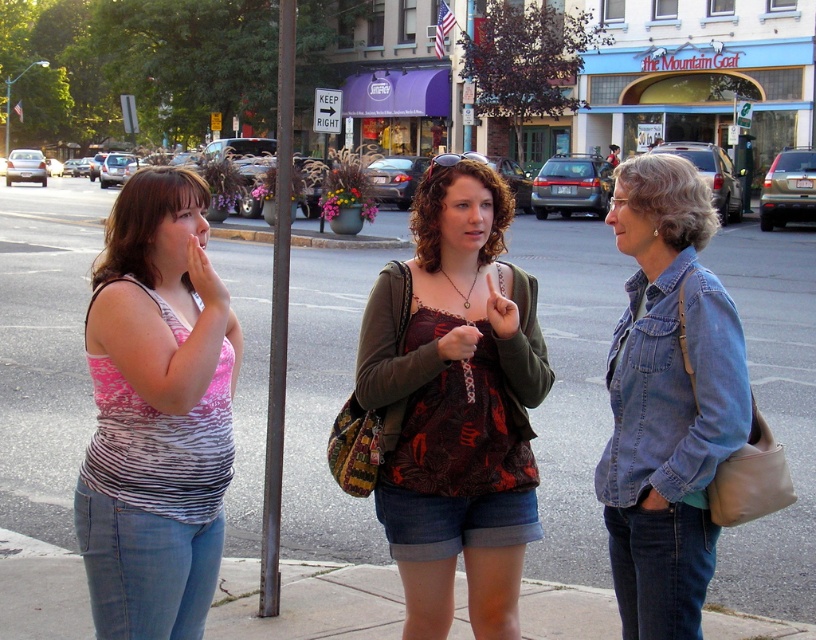
Question: Does pink striped tank top at left lie in front of denim jacket at lower right?

Choices:
 (A) yes
 (B) no

Answer: (A)

Question: Based on their relative distances, which object is nearer to the paved concrete sidewalk at center?

Choices:
 (A) dark gray metal pole at center
 (B) matte brown purse at center
 (C) pink striped tank top at left

Answer: (A)

Question: Is paved concrete sidewalk at center bigger than matte brown purse at center?

Choices:
 (A) yes
 (B) no

Answer: (A)

Question: Does matte brown purse at center appear over denim jacket at lower right?

Choices:
 (A) no
 (B) yes

Answer: (A)

Question: Which point is farther to the camera?

Choices:
 (A) dark gray metal pole at center
 (B) paved concrete sidewalk at center
 (C) pink striped tank top at left

Answer: (B)

Question: Considering the real-world distances, which object is farthest from the matte brown purse at center?

Choices:
 (A) denim jacket at lower right
 (B) dark gray metal pole at center

Answer: (B)